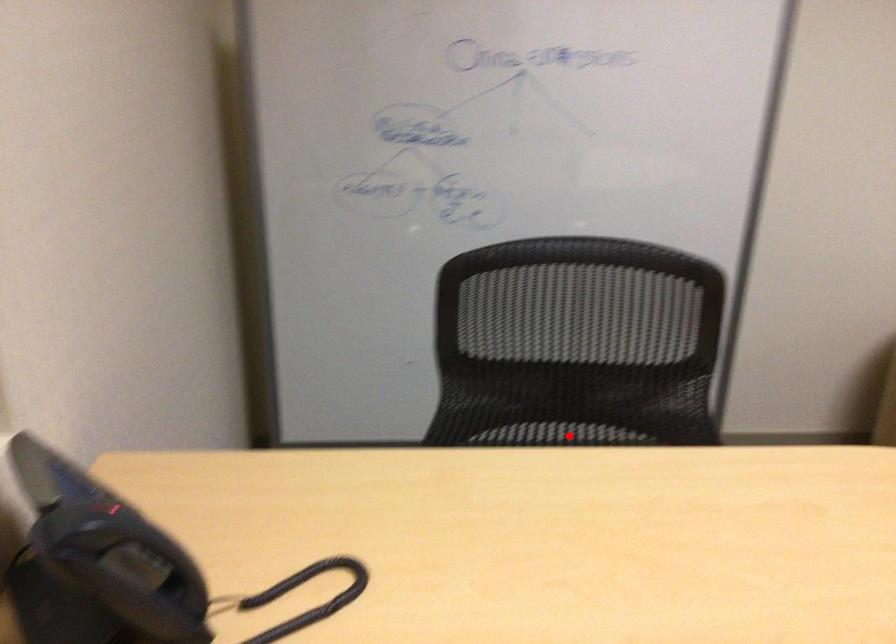
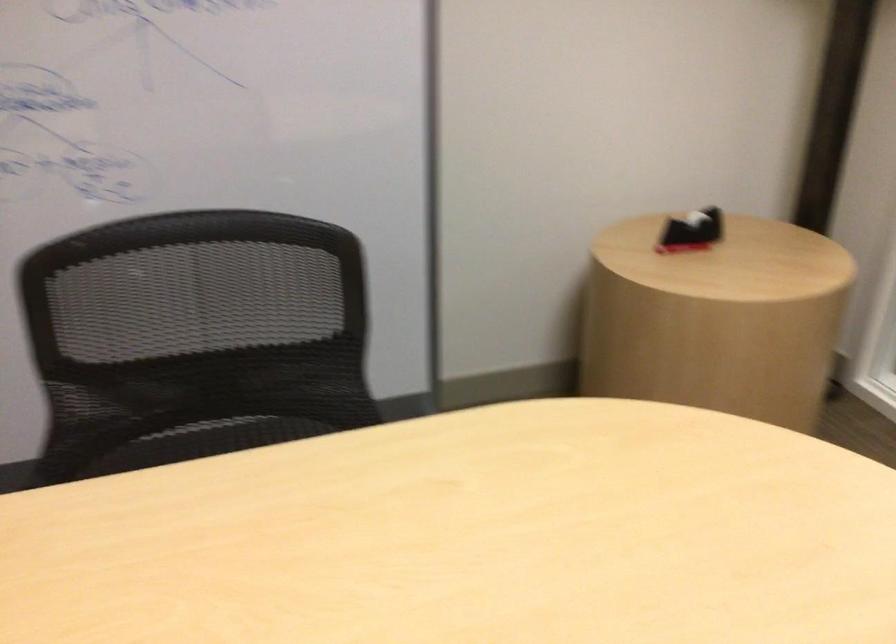
Question: I am providing you with two images of the same scene from different viewpoints. A red point is marked on the first image. Is the red point's position out of view in image 2?

Choices:
 (A) Yes
 (B) No

Answer: (B)